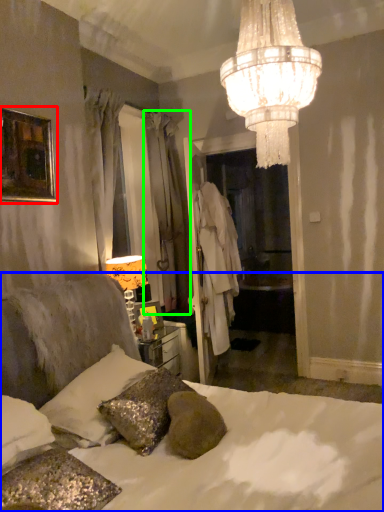
Question: Considering the real-world distances, which object is closest to picture frame (highlighted by a red box)? bed (highlighted by a blue box) or curtain (highlighted by a green box).

Choices:
 (A) bed
 (B) curtain

Answer: (A)